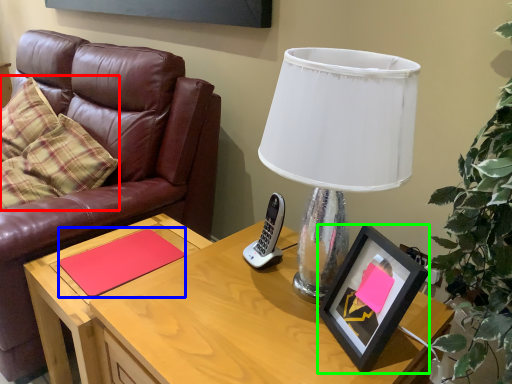
Question: Which is farther away from pillow (highlighted by a red box)? notepad (highlighted by a blue box) or picture frame (highlighted by a green box)?

Choices:
 (A) notepad
 (B) picture frame

Answer: (B)